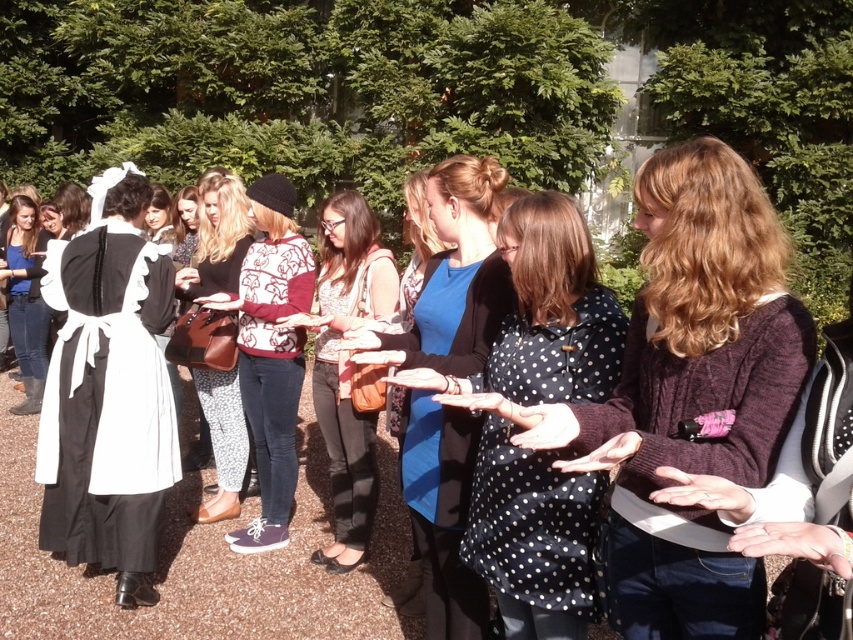
You are standing at the entrance of the garden and want to find the blue fabric dress at center. According to the coordinates provided, in which direction should you move to locate it?

The blue fabric dress at center is located at coordinates point (451, 276). Since the coordinate system is not specified, it is recommended to move towards the central area of the garden to find it.

You are organizing a photoshoot and need to position two models wearing the blue fabric dress at center and the white cotton dress at center. The camera has a focal length of 50mm and you want to ensure both dresses are in focus. Given the depth of field at this setting, what is the minimum distance the dresses must be from the camera to maintain sharpness?

The blue fabric dress at center is 79.78 centimeters away from white cotton dress at center. To maintain sharpness with a 50mm lens, both dresses must be positioned at least 1 meter away from the camera.

You are standing in the garden and want to take a photo of both the point at [277,481] and the point at [22,196]. Which point should you focus on first to ensure both are in clear view?

You should focus on point [277,481] first because it is closer to the camera than point [22,196], ensuring both points are in focus.